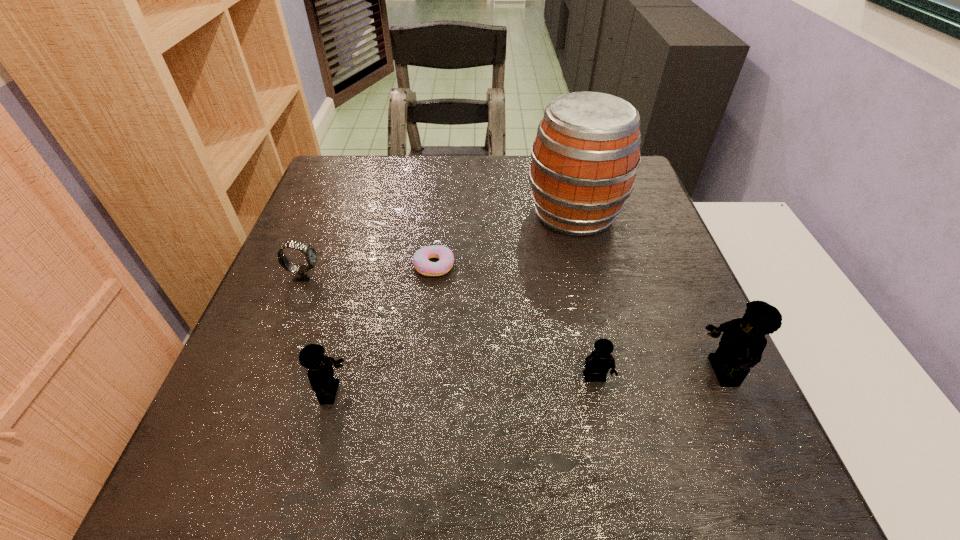
What are the coordinates of `vacant position at the far left corner of the desktop` in the screenshot? It's located at (365, 156).

This screenshot has width=960, height=540. I want to click on vacant space at the far right corner of the desktop, so click(640, 190).

Locate an element on the screen. vacant space that is in between the leftmost object and the shortest Lego is located at coordinates (449, 327).

Where is `free spot between the fifth shortest object and the watch`? The height and width of the screenshot is (540, 960). free spot between the fifth shortest object and the watch is located at coordinates (513, 323).

At what (x,y) coordinates should I click in order to perform the action: click on vacant space in between the leftmost object and the rightmost object. Please return your answer as a coordinate pair (x, y). The image size is (960, 540). Looking at the image, I should click on (513, 323).

Find the location of a particular element. empty location between the second tallest object and the leftmost object is located at coordinates (513, 323).

Find the location of a particular element. The image size is (960, 540). free space between the fifth object from right to left and the tallest Lego is located at coordinates [x=526, y=382].

The width and height of the screenshot is (960, 540). What are the coordinates of `vacant area that lies between the second tallest Lego and the tallest Lego` in the screenshot? It's located at coord(526,382).

Identify the location of free space between the leftmost object and the shortest object. The image size is (960, 540). (369, 271).

Find the location of a particular element. Image resolution: width=960 pixels, height=540 pixels. blank region between the watch and the cider is located at coordinates (440, 244).